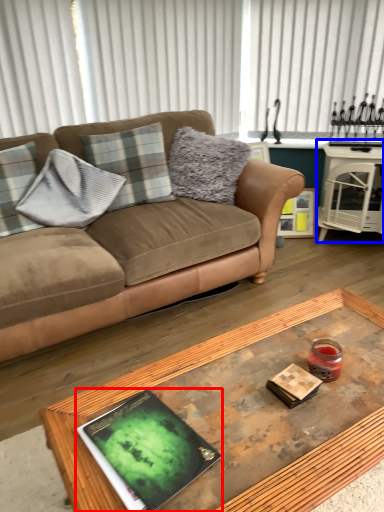
Question: Which object is closer to the camera taking this photo, magazine (highlighted by a red box) or table (highlighted by a blue box)?

Choices:
 (A) magazine
 (B) table

Answer: (A)